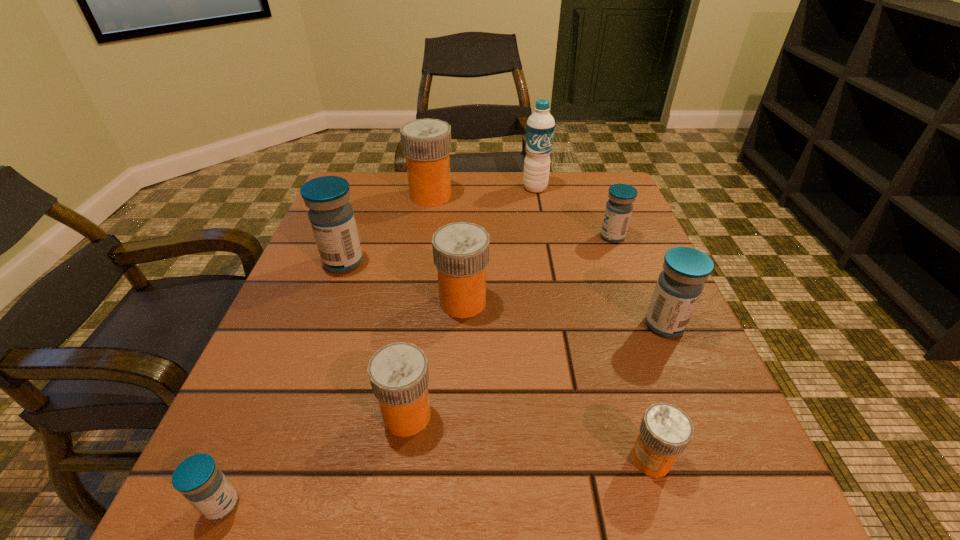
Locate an element on the screen. vacant space located 0.160m on the label side of the second smallest orange medicine is located at coordinates (540, 415).

The image size is (960, 540). What are the coordinates of `vacant position located on the left of the seventh nearest medicine` in the screenshot? It's located at (525, 237).

Where is `free location located on the label side of the sixth medicine from left to right`? This screenshot has height=540, width=960. free location located on the label side of the sixth medicine from left to right is located at coordinates (551, 459).

Image resolution: width=960 pixels, height=540 pixels. Find the location of `vacant region located 0.390m on the label side of the sixth medicine from left to right`. vacant region located 0.390m on the label side of the sixth medicine from left to right is located at coordinates (348, 459).

This screenshot has width=960, height=540. Identify the location of free space located on the label side of the sixth medicine from left to right. (500, 459).

The height and width of the screenshot is (540, 960). I want to click on vacant region located on the back of the smallest blue medicine, so click(x=258, y=420).

At what (x,y) coordinates should I click in order to perform the action: click on water bottle located in the far edge section of the desktop. Please return your answer as a coordinate pair (x, y). Looking at the image, I should click on click(540, 126).

Where is `medicine situated at the far edge`? The image size is (960, 540). medicine situated at the far edge is located at coordinates (426, 143).

You are a GUI agent. You are given a task and a screenshot of the screen. Output one action in this format:
    pyautogui.click(x=<x>, y=<y>)
    Task: Click on the object located in the near left corner section of the desktop
    The width and height of the screenshot is (960, 540).
    Given the screenshot: What is the action you would take?
    pyautogui.click(x=203, y=484)

Where is `object situated at the near right corner`? Image resolution: width=960 pixels, height=540 pixels. object situated at the near right corner is located at coordinates (665, 431).